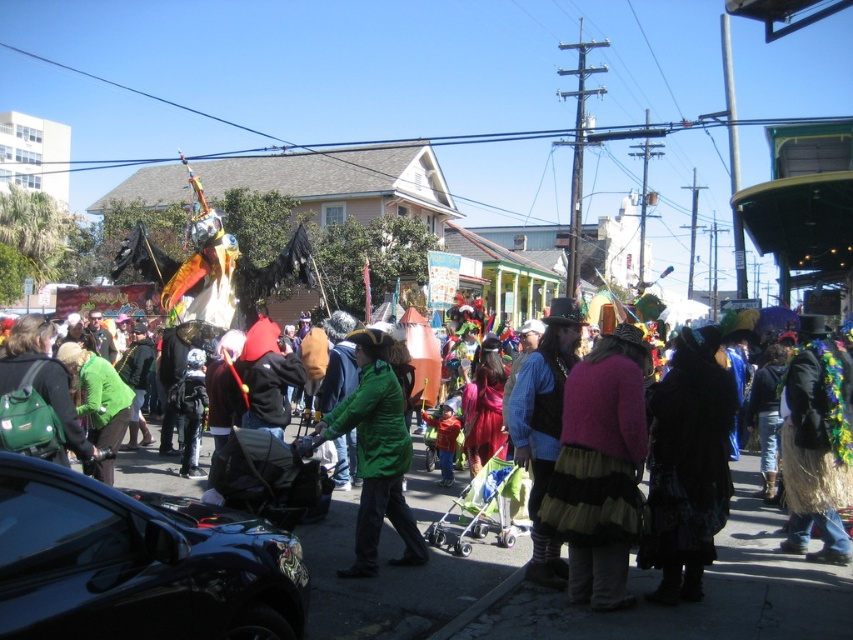
You are a photographer standing in the middle of the street during the parade. You want to take a photo that includes both the shiny metallic balloon at center and the green matte jacket at center. Which object should you focus on first to ensure both are in the frame?

The shiny metallic balloon at center is closer to you than the green matte jacket at center, so you should focus on the shiny metallic balloon at center first to ensure both are in the frame.